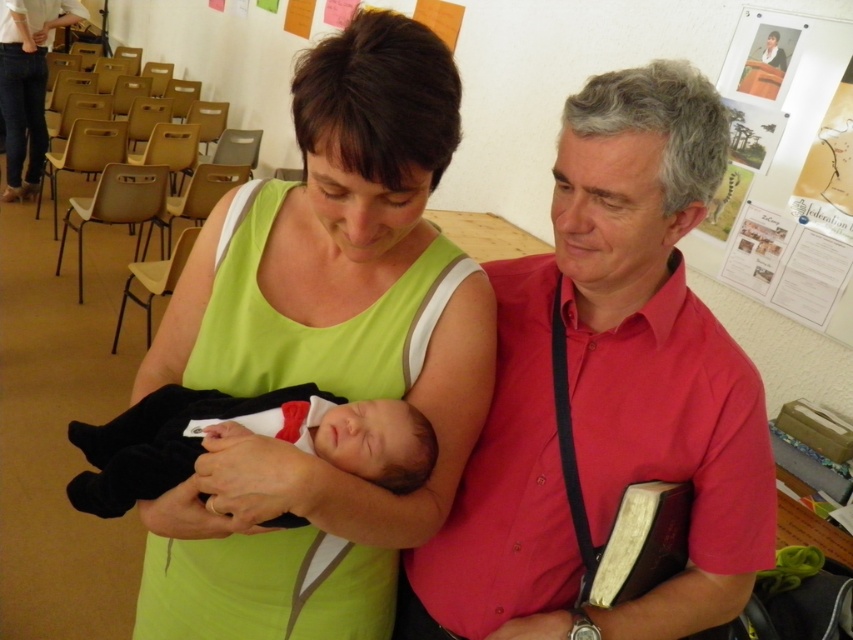
Please describe the location of the green fabric dress at center in the image using the coordinate system where the bottom left corner is the origin point. The coordinate is given as a pair of numbers between 0 and 1, with the first number representing the horizontal axis and the second number representing the vertical axis. The coordinate provided is an approximate value. Please answer with the coordinate values rounded to two decimal places.

The green fabric dress at center is located at approximately (323, 352) in the coordinate system described.